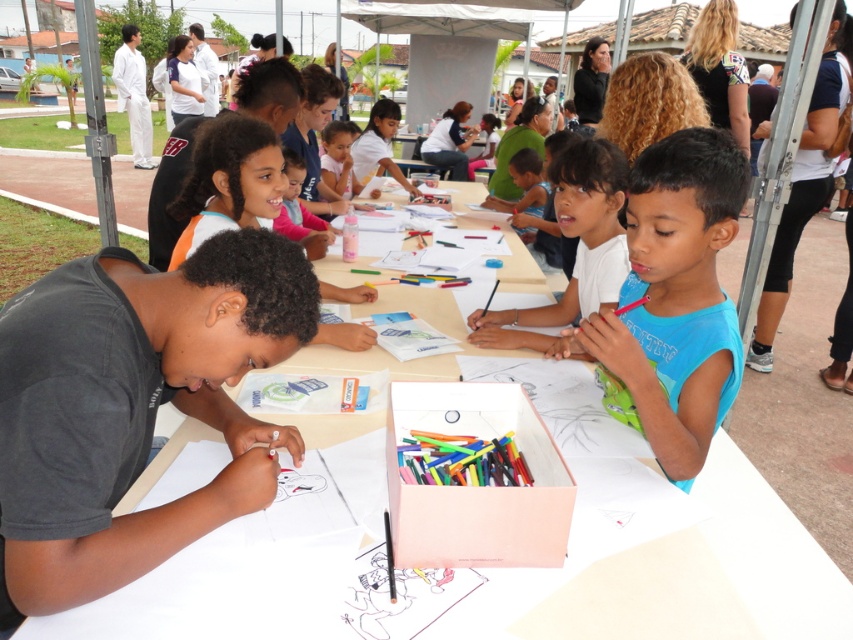
Looking at this image, you are a teacher organizing an art activity for children. You have a white paper at center and a matte pink shirt at center in front of you. Which item has a greater width?

The white paper at center has a greater width than the matte pink shirt at center.

You are a parent trying to take a photo of your child at the art activity. You want to ensure the white paper at center and the light blue shirt at center are both visible in the frame. Based on their positions, which object should be placed closer to the left side of the photo?

The white paper at center is positioned on the left side of light blue shirt at center, so to have both visible, the white paper at center should be closer to the left side of the photo.